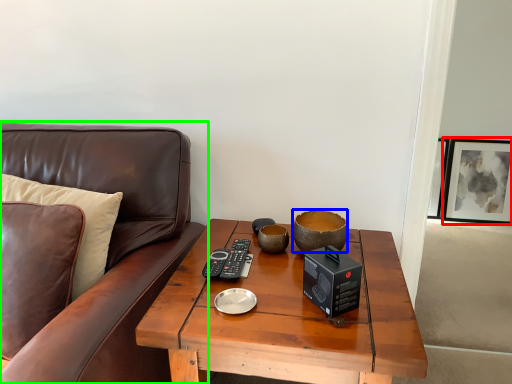
Question: Considering the real-world distances, which object is farthest from picture frame (highlighted by a red box)? bowl (highlighted by a blue box) or studio couch (highlighted by a green box)?

Choices:
 (A) bowl
 (B) studio couch

Answer: (B)